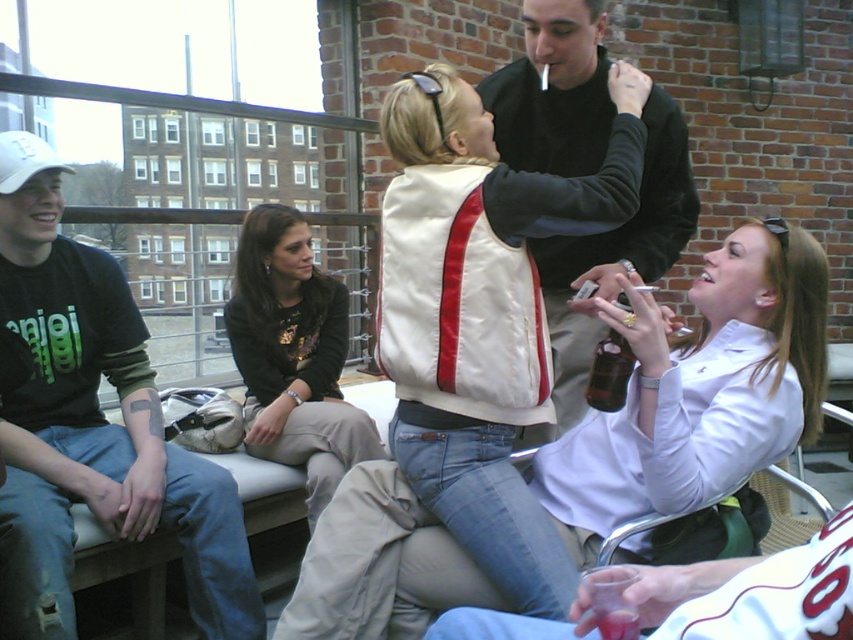
Question: Among these objects, which one is nearest to the camera?

Choices:
 (A) velvet black jacket at upper center
 (B) white leather jacket at center
 (C) dark brown leather jacket at center

Answer: (B)

Question: From the image, what is the correct spatial relationship of dark green t-shirt at left in relation to velvet black jacket at upper center?

Choices:
 (A) below
 (B) above

Answer: (A)

Question: Among these points, which one is nearest to the camera?

Choices:
 (A) (519, 74)
 (B) (618, 413)

Answer: (B)

Question: Is dark green t-shirt at left bigger than dark brown leather jacket at center?

Choices:
 (A) yes
 (B) no

Answer: (A)

Question: Which object appears farthest from the camera in this image?

Choices:
 (A) velvet black jacket at upper center
 (B) dark green t-shirt at left
 (C) white leather jacket at center

Answer: (B)

Question: Can you confirm if dark green t-shirt at left is wider than dark brown leather jacket at center?

Choices:
 (A) no
 (B) yes

Answer: (B)